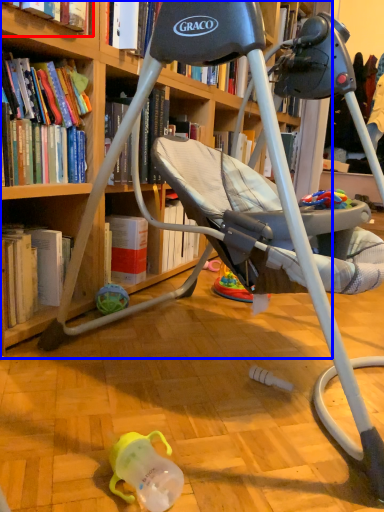
Question: Which object appears farthest to the camera in this image, book (highlighted by a red box) or bookcase (highlighted by a blue box)?

Choices:
 (A) book
 (B) bookcase

Answer: (A)